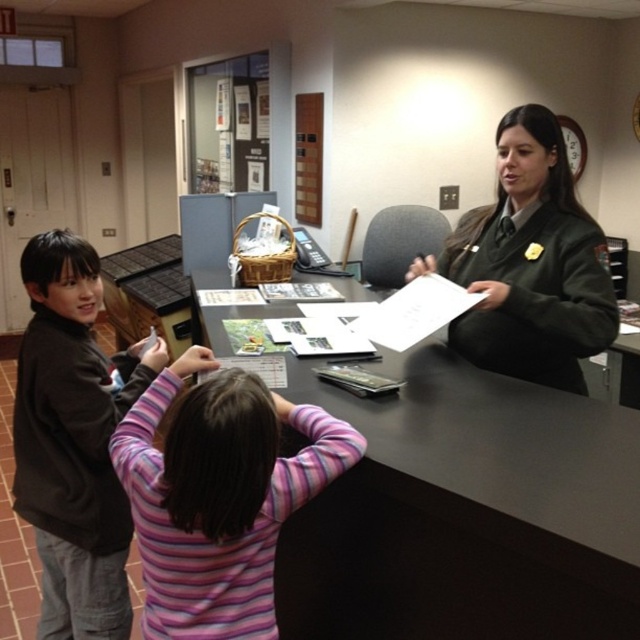
Is striped sweater at center further to camera compared to green uniform at center?

No, it is in front of green uniform at center.

Can you confirm if striped sweater at center is positioned to the right of green uniform at center?

In fact, striped sweater at center is to the left of green uniform at center.

Does point (147, 397) come in front of point (534, 262)?

Yes, it is in front of point (534, 262).

You are a GUI agent. You are given a task and a screenshot of the screen. Output one action in this format:
    pyautogui.click(x=<x>, y=<y>)
    Task: Click on the striped sweater at center
    The image size is (640, 640).
    Given the screenshot: What is the action you would take?
    pyautogui.click(x=218, y=496)

Is point (636, 419) in front of point (483, 220)?

Yes.

Is black matte table at center smaller than green uniform at center?

Actually, black matte table at center might be larger than green uniform at center.

Is point (611, 534) behind point (556, 154)?

No, it is in front of (556, 154).

I want to click on black matte table at center, so click(467, 513).

Does striped sweater at center have a lesser width compared to brown soft sweater at left?

Incorrect, striped sweater at center's width is not less than brown soft sweater at left's.

Which is in front, point (150, 566) or point (45, 257)?

Positioned in front is point (150, 566).

At what (x,y) coordinates should I click in order to perform the action: click on striped sweater at center. Please return your answer as a coordinate pair (x, y). This screenshot has width=640, height=640. Looking at the image, I should click on (218, 496).